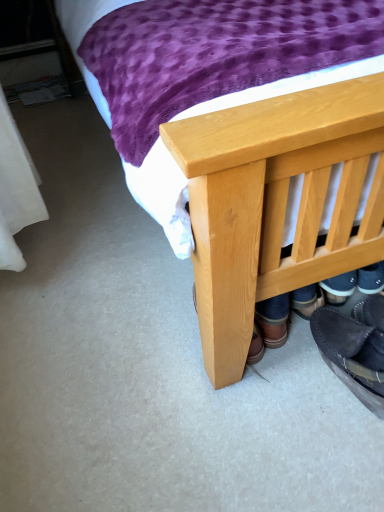
Question: Would you say dark brown leather shoe at lower right is outside natural wood bed at center?

Choices:
 (A) yes
 (B) no

Answer: (B)

Question: Are dark brown leather shoe at lower right and natural wood bed at center located far from each other?

Choices:
 (A) yes
 (B) no

Answer: (B)

Question: Does dark brown leather shoe at lower right appear on the left side of natural wood bed at center?

Choices:
 (A) no
 (B) yes

Answer: (B)

Question: Is dark brown leather shoe at lower right further to camera compared to natural wood bed at center?

Choices:
 (A) yes
 (B) no

Answer: (A)

Question: Is dark brown leather shoe at lower right turned away from natural wood bed at center?

Choices:
 (A) yes
 (B) no

Answer: (A)

Question: Is dark brown leather shoe at lower right wider than natural wood bed at center?

Choices:
 (A) yes
 (B) no

Answer: (B)

Question: Would you say natural wood bed at center contains dark brown leather shoe at lower right?

Choices:
 (A) yes
 (B) no

Answer: (A)

Question: Is natural wood bed at center thinner than dark brown leather shoe at lower right?

Choices:
 (A) yes
 (B) no

Answer: (B)

Question: Is natural wood bed at center completely or partially outside of dark brown leather shoe at lower right?

Choices:
 (A) yes
 (B) no

Answer: (A)

Question: Is natural wood bed at center oriented away from dark brown leather shoe at lower right?

Choices:
 (A) yes
 (B) no

Answer: (B)

Question: Considering the relative sizes of natural wood bed at center and dark brown leather shoe at lower right in the image provided, is natural wood bed at center smaller than dark brown leather shoe at lower right?

Choices:
 (A) yes
 (B) no

Answer: (B)

Question: Can you confirm if natural wood bed at center is bigger than dark brown leather shoe at lower right?

Choices:
 (A) no
 (B) yes

Answer: (B)

Question: Considering the positions of point (256, 279) and point (317, 335), is point (256, 279) closer or farther from the camera than point (317, 335)?

Choices:
 (A) closer
 (B) farther

Answer: (A)